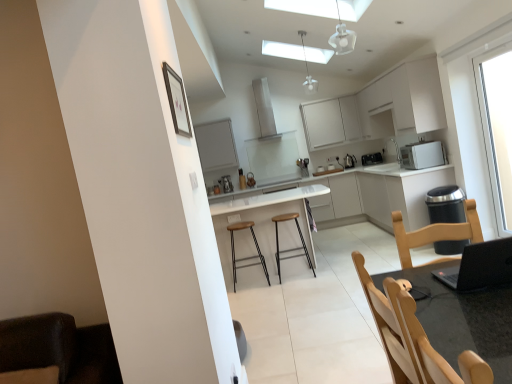
Question: Are metallic silver bar stool at center, the second bar stool when ordered from left to right, and black plastic toaster at upper right, the 2th appliance positioned from the back, far apart?

Choices:
 (A) yes
 (B) no

Answer: (A)

Question: Does metallic silver bar stool at center, the second bar stool when ordered from left to right, have a lesser height compared to black plastic toaster at upper right, the 2th appliance positioned from the back?

Choices:
 (A) no
 (B) yes

Answer: (A)

Question: Is metallic silver bar stool at center, which appears as the 1th bar stool when viewed from the right, wider than black plastic toaster at upper right, which is the 2th appliance in front-to-back order?

Choices:
 (A) yes
 (B) no

Answer: (A)

Question: Is metallic silver bar stool at center, the second bar stool when ordered from left to right, further to camera compared to black plastic toaster at upper right, the 2th appliance positioned from the back?

Choices:
 (A) yes
 (B) no

Answer: (B)

Question: Can you confirm if metallic silver bar stool at center, the second bar stool when ordered from left to right, is bigger than black plastic toaster at upper right, the 2th appliance positioned from the back?

Choices:
 (A) no
 (B) yes

Answer: (B)

Question: In the image, is black plastic toaster at upper right, which is the 2th appliance in front-to-back order, positioned in front of or behind polished stainless steel kettle at center-right, placed as the third appliance when sorted from front to back?

Choices:
 (A) behind
 (B) front

Answer: (B)

Question: Do you think black plastic toaster at upper right, the 2th appliance positioned from the back, is within polished stainless steel kettle at center-right, positioned as the 1th appliance in back-to-front order, or outside of it?

Choices:
 (A) inside
 (B) outside

Answer: (B)

Question: From a real-world perspective, is black plastic toaster at upper right, the 2th appliance positioned from the back, positioned above or below polished stainless steel kettle at center-right, positioned as the 1th appliance in back-to-front order?

Choices:
 (A) above
 (B) below

Answer: (B)

Question: Based on their sizes in the image, would you say black plastic toaster at upper right, the 2th appliance positioned from the back, is bigger or smaller than polished stainless steel kettle at center-right, positioned as the 1th appliance in back-to-front order?

Choices:
 (A) big
 (B) small

Answer: (A)

Question: Is white matte exhaust hood at upper center spatially inside metallic silver bar stool at center, which appears as the 1th bar stool when viewed from the right, or outside of it?

Choices:
 (A) outside
 (B) inside

Answer: (A)

Question: From the image's perspective, relative to metallic silver bar stool at center, which appears as the 1th bar stool when viewed from the right, is white matte exhaust hood at upper center above or below?

Choices:
 (A) above
 (B) below

Answer: (A)

Question: Is white matte exhaust hood at upper center in front of or behind metallic silver bar stool at center, which appears as the 1th bar stool when viewed from the right, in the image?

Choices:
 (A) behind
 (B) front

Answer: (A)

Question: Is point (276, 114) closer or farther from the camera than point (279, 279)?

Choices:
 (A) closer
 (B) farther

Answer: (B)

Question: Considering the positions of brown leather bar stool at center, which is the 1th bar stool in left-to-right order, and white matte exhaust hood at upper center in the image, is brown leather bar stool at center, which is the 1th bar stool in left-to-right order, taller or shorter than white matte exhaust hood at upper center?

Choices:
 (A) short
 (B) tall

Answer: (A)

Question: Looking at their shapes, would you say brown leather bar stool at center, marked as the 2th bar stool in a right-to-left arrangement, is wider or thinner than white matte exhaust hood at upper center?

Choices:
 (A) thin
 (B) wide

Answer: (A)